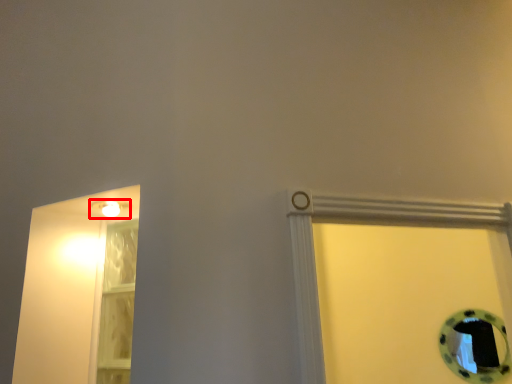
Question: From the image's perspective, what is the correct spatial positioning of light fixture (annotated by the red box) in reference to glass door?

Choices:
 (A) above
 (B) below

Answer: (A)